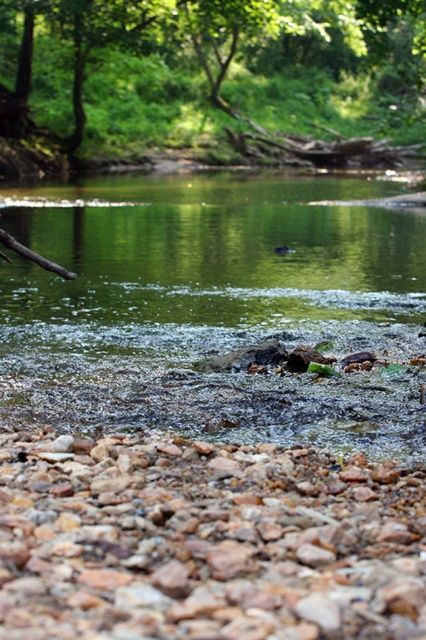
Question: Can you confirm if rusty gravel rocks at lower center is smaller than green leafy tree at upper center?

Choices:
 (A) yes
 (B) no

Answer: (A)

Question: Which object is farther from the camera taking this photo?

Choices:
 (A) green leafy tree at upper center
 (B) green mossy rock at center

Answer: (A)

Question: Which of the following is the closest to the observer?

Choices:
 (A) (245, 124)
 (B) (63, 397)
 (C) (417, 586)

Answer: (C)

Question: Among these points, which one is farthest from the camera?

Choices:
 (A) (108, 134)
 (B) (120, 230)
 (C) (377, 637)

Answer: (A)

Question: Does green mossy rock at center appear on the right side of rusty gravel rocks at lower center?

Choices:
 (A) yes
 (B) no

Answer: (B)

Question: From the image, what is the correct spatial relationship of green mossy rock at center in relation to green leafy tree at upper center?

Choices:
 (A) above
 (B) below

Answer: (B)